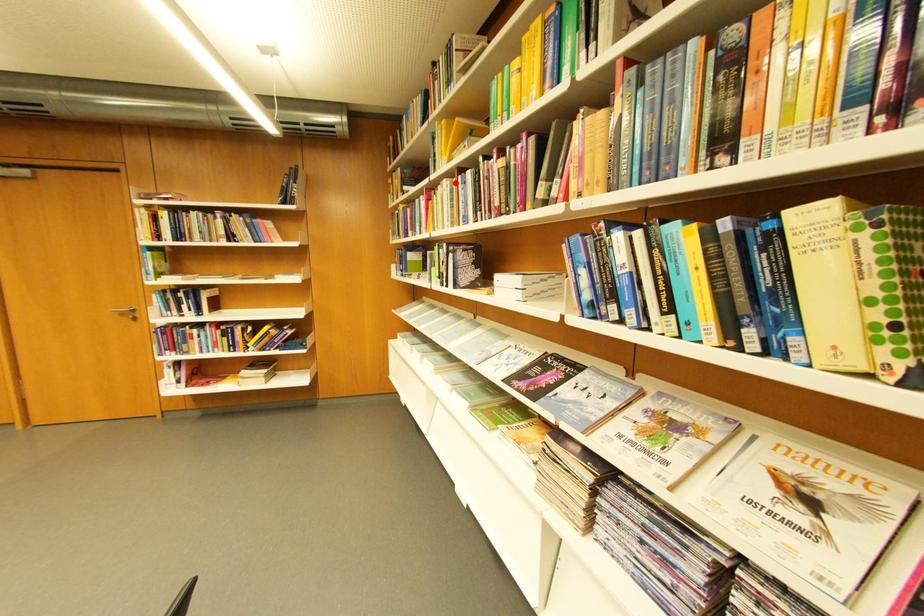
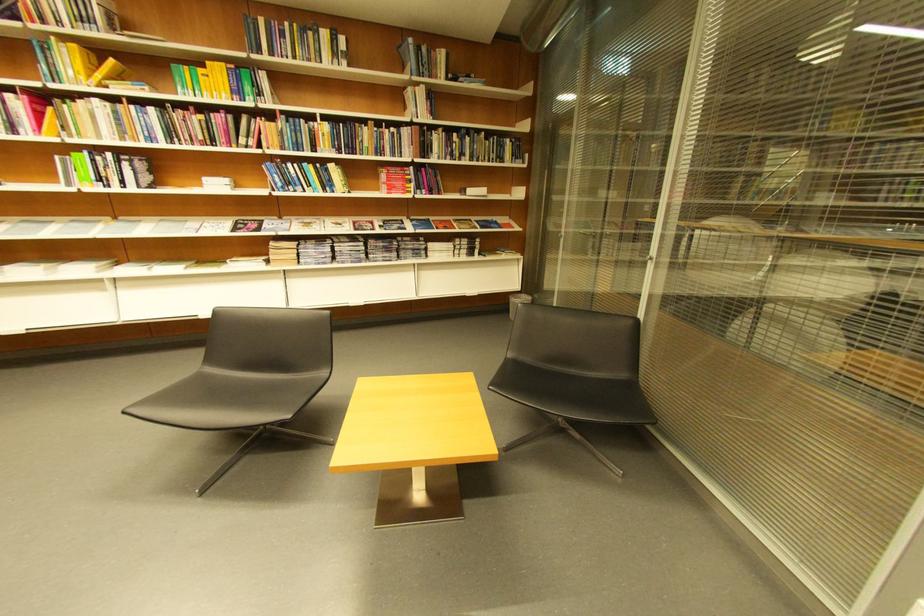
Where in the second image is the point corresponding to the highlighted location from the first image?

(106, 102)